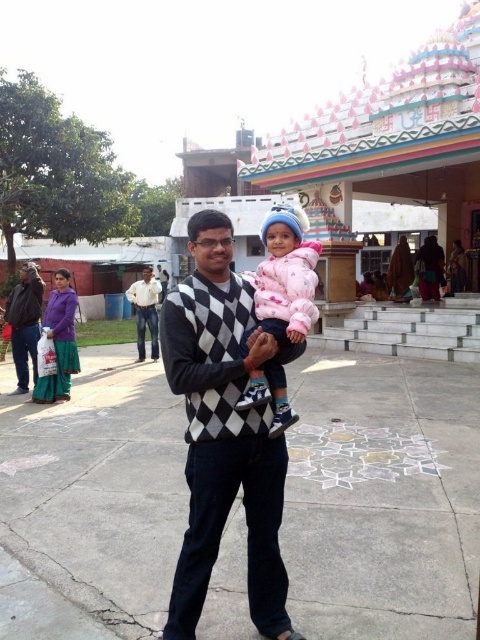
How much distance is there between pink fleece jacket at center and white cotton shirt at center?

pink fleece jacket at center is 34.66 feet away from white cotton shirt at center.

Is pink fleece jacket at center above white cotton shirt at center?

No.

The image size is (480, 640). I want to click on pink fleece jacket at center, so click(287, 275).

Find the location of a particular element. pink fleece jacket at center is located at coordinates (287, 275).

Can you confirm if argyle sweater at center is shorter than white cotton shirt at center?

Yes.

Is argyle sweater at center above white cotton shirt at center?

Incorrect, argyle sweater at center is not positioned above white cotton shirt at center.

Locate an element on the screen. argyle sweater at center is located at coordinates (224, 429).

Is purple cotton dress at lower left shorter than white cotton shirt at center?

Correct, purple cotton dress at lower left is not as tall as white cotton shirt at center.

Between point (67, 326) and point (144, 332), which one is positioned behind?

The point (144, 332) is more distant.

The width and height of the screenshot is (480, 640). I want to click on purple cotton dress at lower left, so click(60, 340).